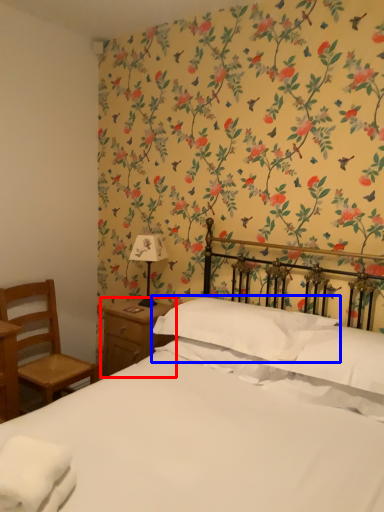
Question: Among these objects, which one is nearest to the camera, nightstand (highlighted by a red box) or pillow (highlighted by a blue box)?

Choices:
 (A) nightstand
 (B) pillow

Answer: (B)